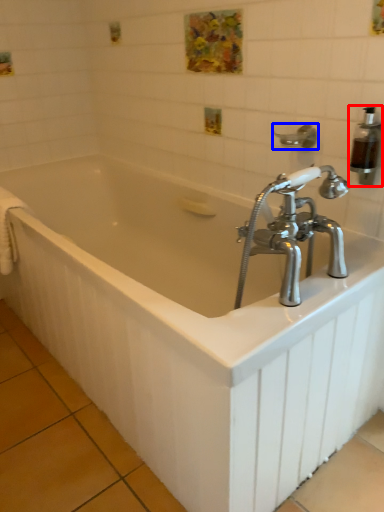
Question: Which object appears farthest to the camera in this image, soap dispenser (highlighted by a red box) or shower (highlighted by a blue box)?

Choices:
 (A) soap dispenser
 (B) shower

Answer: (B)